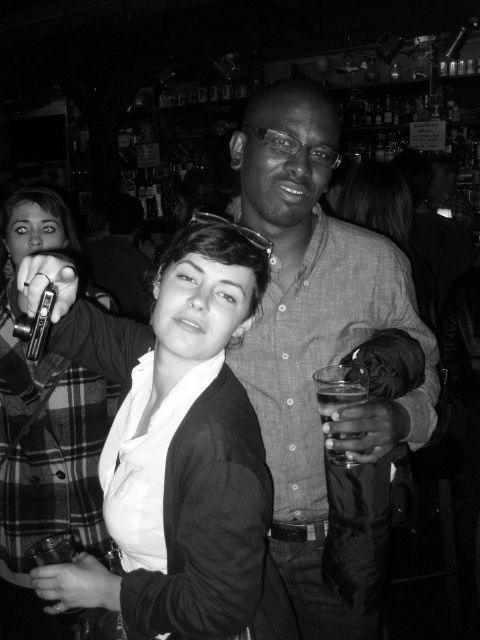
Looking at this image, you are standing in the dimly lit indoor setting of the image. There are two points marked in the scene. The first point is at coordinates point (277, 449) and the second at point (370, 227). Which of these two points is nearer to you as the observer?

Point (277, 449) is closer to the camera than point (370, 227), so the first point is nearer to you as the observer.

You are organizing a photo shoot and need to ensure that the matte black jacket at center and the matte black blazer at center are both visible in the frame. Given their sizes, which one might you need to position closer to the camera to ensure it appears larger in the photo?

The matte black jacket at center occupies less space than the matte black blazer at center, so to make the jacket appear larger in the photo, you should position the matte black jacket at center closer to the camera.

You are organizing a photo album and need to place the matte gray shirt at center and the plaid fabric jacket at left into a section based on their sizes. Which one should you place first if you want to arrange them from smallest to largest?

The matte gray shirt at center is smaller than the plaid fabric jacket at left, so you should place the matte gray shirt at center first when arranging from smallest to largest.